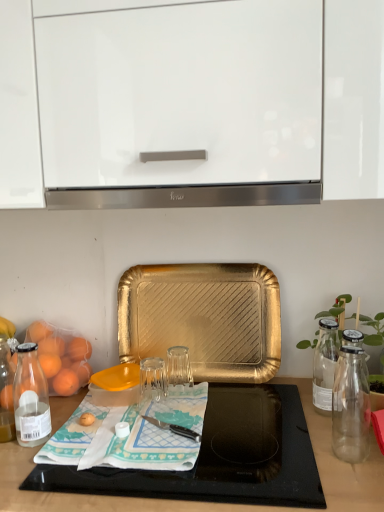
Where is `empty space that is to the right of teal fabric placemat at center`? The height and width of the screenshot is (512, 384). empty space that is to the right of teal fabric placemat at center is located at coordinates (258, 430).